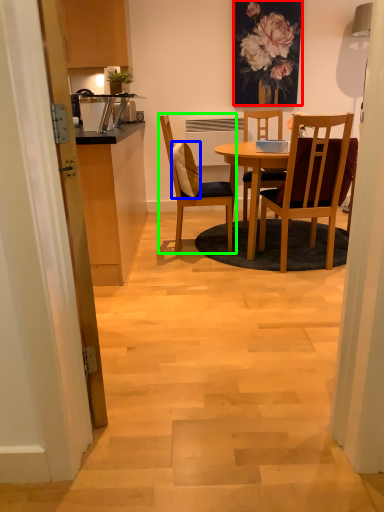
Question: Considering the real-world distances, which object is closest to floral arrangement (highlighted by a red box)? pillow (highlighted by a blue box) or chair (highlighted by a green box).

Choices:
 (A) pillow
 (B) chair

Answer: (A)